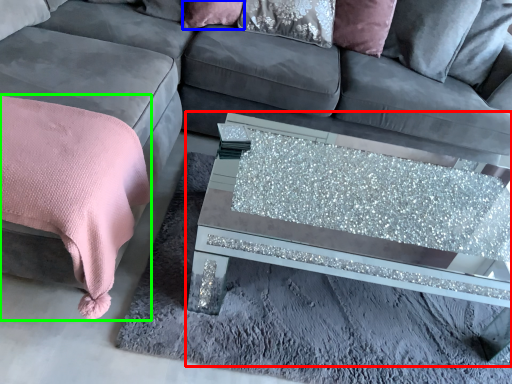
Question: Which is nearer to the coffee table (highlighted by a red box)? pillow (highlighted by a blue box) or blanket (highlighted by a green box).

Choices:
 (A) pillow
 (B) blanket

Answer: (B)